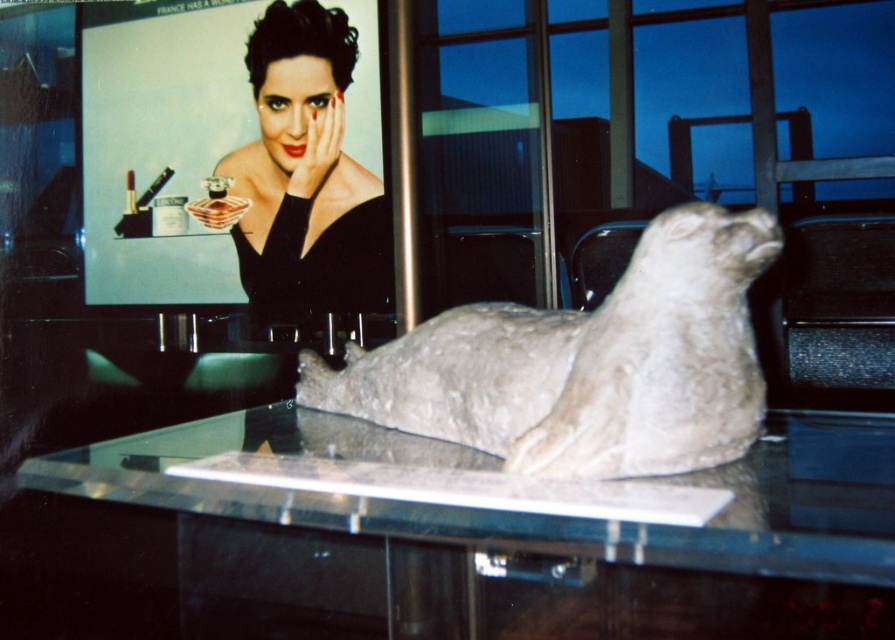
Is clear glass table at center wider than matte black dress at upper center?

Correct, the width of clear glass table at center exceeds that of matte black dress at upper center.

You are a GUI agent. You are given a task and a screenshot of the screen. Output one action in this format:
    pyautogui.click(x=<x>, y=<y>)
    Task: Click on the clear glass table at center
    The height and width of the screenshot is (640, 895).
    Given the screenshot: What is the action you would take?
    pyautogui.click(x=441, y=545)

Is point (158, 524) in front of point (450, 404)?

No, (158, 524) is behind (450, 404).

Who is more distant from viewer, (297,435) or (697,253)?

The point (297,435) is more distant.

Image resolution: width=895 pixels, height=640 pixels. Identify the location of clear glass table at center. (441, 545).

Can you confirm if gray stone seal at center is positioned above matte black dress at upper center?

No.

Is gray stone seal at center taller than matte black dress at upper center?

No, gray stone seal at center is not taller than matte black dress at upper center.

Identify the location of gray stone seal at center. (585, 364).